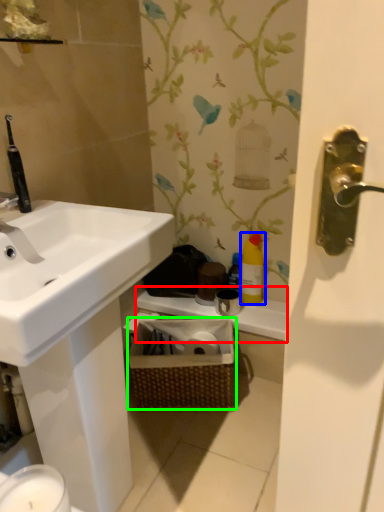
Question: Which object is the closest to the counter top (highlighted by a red box)? Choose among these: cleaning product (highlighted by a blue box) or basket (highlighted by a green box).

Choices:
 (A) cleaning product
 (B) basket

Answer: (A)